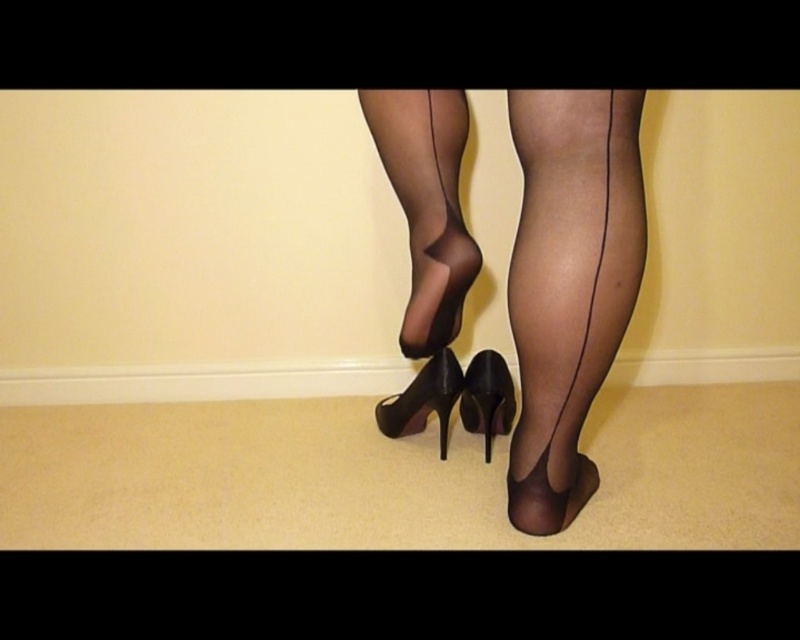
You are a fashion designer examining a model wearing transparent nylon leg at center. To ensure the design is visible from all angles, where should you place the lighting? Please provide coordinates in the format of x,y where x and y are between 0 and 1.

The transparent nylon leg at center is located at point (426,243). To ensure visibility from all angles, place lighting at (426,243).